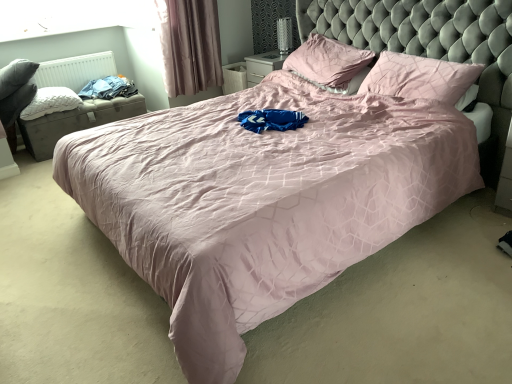
What do you see at coordinates (75, 70) in the screenshot? This screenshot has width=512, height=384. I see `white matte radiator at upper left` at bounding box center [75, 70].

This screenshot has width=512, height=384. Describe the element at coordinates (71, 16) in the screenshot. I see `transparent glass window screen at upper left` at that location.

What do you see at coordinates (420, 78) in the screenshot?
I see `pink fabric pillow at upper right, acting as the first pillow starting from the right` at bounding box center [420, 78].

The width and height of the screenshot is (512, 384). Describe the element at coordinates (189, 45) in the screenshot. I see `mauve velvet curtain at upper left` at that location.

Describe the element at coordinates (51, 102) in the screenshot. I see `white quilted pillow at left, arranged as the 1th pillow when viewed from the left` at that location.

The image size is (512, 384). Describe the element at coordinates (330, 64) in the screenshot. I see `pink satin pillow at upper center, which is the second pillow from right to left` at that location.

Identify the location of pink satin pillow at upper center, which is the second pillow from right to left. (330, 64).

Locate an element on the screen. Image resolution: width=512 pixels, height=384 pixels. blue cotton clothes at left is located at coordinates (108, 88).

Identify the location of white matte radiator at upper left. (75, 70).

Can you confirm if pink fabric pillow at upper right, which is the third pillow in left-to-right order, is thinner than blue cotton clothes at left?

Indeed, pink fabric pillow at upper right, which is the third pillow in left-to-right order, has a lesser width compared to blue cotton clothes at left.

Does pink fabric pillow at upper right, which is the third pillow in left-to-right order, have a smaller size compared to blue cotton clothes at left?

Actually, pink fabric pillow at upper right, which is the third pillow in left-to-right order, might be larger than blue cotton clothes at left.

Relative to blue cotton clothes at left, is pink fabric pillow at upper right, acting as the first pillow starting from the right, in front or behind?

Clearly, pink fabric pillow at upper right, acting as the first pillow starting from the right, is in front of blue cotton clothes at left.

Is pink fabric pillow at upper right, which is the third pillow in left-to-right order, not inside blue cotton clothes at left?

That's correct, pink fabric pillow at upper right, which is the third pillow in left-to-right order, is outside of blue cotton clothes at left.

Considering the positions of point (77, 0) and point (41, 105), is point (77, 0) closer or farther from the camera than point (41, 105)?

Clearly, point (77, 0) is more distant from the camera than point (41, 105).

Is transparent glass window screen at upper left bigger than white quilted pillow at left, marked as the 3th pillow in a right-to-left arrangement?

Incorrect, transparent glass window screen at upper left is not larger than white quilted pillow at left, marked as the 3th pillow in a right-to-left arrangement.

Which of these two, transparent glass window screen at upper left or white quilted pillow at left, marked as the 3th pillow in a right-to-left arrangement, is wider?

Wider between the two is white quilted pillow at left, marked as the 3th pillow in a right-to-left arrangement.

Is transparent glass window screen at upper left oriented away from white quilted pillow at left, arranged as the 1th pillow when viewed from the left?

No, transparent glass window screen at upper left is not facing the opposite direction of white quilted pillow at left, arranged as the 1th pillow when viewed from the left.

Is metallic silver table lamp at upper center far away from transparent glass window screen at upper left?

Yes.

Can you confirm if metallic silver table lamp at upper center is wider than transparent glass window screen at upper left?

Yes, metallic silver table lamp at upper center is wider than transparent glass window screen at upper left.

Based on the photo, between metallic silver table lamp at upper center and transparent glass window screen at upper left, which one is positioned in front?

transparent glass window screen at upper left.

Is metallic silver table lamp at upper center oriented towards transparent glass window screen at upper left?

No, metallic silver table lamp at upper center is not oriented towards transparent glass window screen at upper left.

Consider the image. Is blue cotton clothes at left completely or partially outside of mauve velvet curtain at upper left?

Yes.

Who is taller, blue cotton clothes at left or mauve velvet curtain at upper left?

With more height is mauve velvet curtain at upper left.

From a real-world perspective, is blue cotton clothes at left located beneath mauve velvet curtain at upper left?

Yes, from a real-world perspective, blue cotton clothes at left is under mauve velvet curtain at upper left.

Which is farther, (81, 96) or (213, 4)?

The point (213, 4) is more distant.

Considering the positions of points (55, 109) and (284, 30), is point (55, 109) closer to camera compared to point (284, 30)?

Yes, point (55, 109) is in front of point (284, 30).

The width and height of the screenshot is (512, 384). In order to click on table lamp above the white quilted pillow at left, arranged as the 1th pillow when viewed from the left (from the image's perspective) in this screenshot , I will do `click(284, 35)`.

Is white quilted pillow at left, arranged as the 1th pillow when viewed from the left, wider or thinner than metallic silver table lamp at upper center?

Clearly, white quilted pillow at left, arranged as the 1th pillow when viewed from the left, has more width compared to metallic silver table lamp at upper center.

Can you confirm if white matte radiator at upper left is smaller than white quilted pillow at left, arranged as the 1th pillow when viewed from the left?

Yes, white matte radiator at upper left is smaller than white quilted pillow at left, arranged as the 1th pillow when viewed from the left.

How many degrees apart are the facing directions of white matte radiator at upper left and white quilted pillow at left, arranged as the 1th pillow when viewed from the left?

The angular difference between white matte radiator at upper left and white quilted pillow at left, arranged as the 1th pillow when viewed from the left, is 0.00139 degrees.

Is white matte radiator at upper left wider or thinner than white quilted pillow at left, marked as the 3th pillow in a right-to-left arrangement?

white matte radiator at upper left is thinner than white quilted pillow at left, marked as the 3th pillow in a right-to-left arrangement.

Between point (97, 73) and point (58, 98), which one is positioned in front?

The point (58, 98) is in front.

From the image's perspective, would you say pink satin pillow at upper center, which is the 2th pillow in left-to-right order, is positioned over white matte radiator at upper left?

No, from the image's perspective, pink satin pillow at upper center, which is the 2th pillow in left-to-right order, is not above white matte radiator at upper left.

This screenshot has width=512, height=384. I want to click on the 1st pillow below when counting from the white matte radiator at upper left (from the image's perspective), so click(x=330, y=64).

Can you confirm if pink satin pillow at upper center, which is the second pillow from right to left, is smaller than white matte radiator at upper left?

No.

Is pink satin pillow at upper center, which is the 2th pillow in left-to-right order, facing towards white matte radiator at upper left?

No, pink satin pillow at upper center, which is the 2th pillow in left-to-right order, is not aimed at white matte radiator at upper left.

At what (x,y) coordinates should I click in order to perform the action: click on the 2nd pillow counting from the right side of the blue cotton clothes at left. Please return your answer as a coordinate pair (x, y). Image resolution: width=512 pixels, height=384 pixels. Looking at the image, I should click on (420, 78).

From a real-world perspective, starting from the transparent glass window screen at upper left, which pillow is the 3rd one below it? Please provide its 2D coordinates.

[(51, 102)]

Based on their spatial positions, is pink satin pillow at upper center, which is the second pillow from right to left, or pink fabric pillow at upper right, which is the third pillow in left-to-right order, further from metallic silver table lamp at upper center?

pink fabric pillow at upper right, which is the third pillow in left-to-right order, lies further to metallic silver table lamp at upper center than the other object.

Based on their spatial positions, is blue cotton clothes at left or metallic silver table lamp at upper center further from mauve velvet curtain at upper left?

Based on the image, metallic silver table lamp at upper center appears to be further to mauve velvet curtain at upper left.

Based on the photo, which object lies further to the anchor point mauve velvet curtain at upper left, pink satin pillow at upper center, which is the 2th pillow in left-to-right order, or blue cotton clothes at left?

Among the two, pink satin pillow at upper center, which is the 2th pillow in left-to-right order, is located further to mauve velvet curtain at upper left.

Considering their positions, is mauve velvet curtain at upper left positioned closer to blue cotton clothes at left than white matte radiator at upper left?

The object closer to blue cotton clothes at left is white matte radiator at upper left.

Estimate the real-world distances between objects in this image. Which object is closer to pink fabric pillow at upper right, which is the third pillow in left-to-right order, blue cotton clothes at left or white matte radiator at upper left?

blue cotton clothes at left is closer to pink fabric pillow at upper right, which is the third pillow in left-to-right order.

Estimate the real-world distances between objects in this image. Which object is closer to pink satin pillow at upper center, which is the second pillow from right to left, blue cotton clothes at left or white matte radiator at upper left?

blue cotton clothes at left is closer to pink satin pillow at upper center, which is the second pillow from right to left.

Estimate the real-world distances between objects in this image. Which object is closer to transparent glass window screen at upper left, blue cotton clothes at left or mauve velvet curtain at upper left?

blue cotton clothes at left lies closer to transparent glass window screen at upper left than the other object.

Which object lies further to the anchor point pink satin pillow at upper center, which is the 2th pillow in left-to-right order, white matte radiator at upper left or mauve velvet curtain at upper left?

white matte radiator at upper left lies further to pink satin pillow at upper center, which is the 2th pillow in left-to-right order, than the other object.

Image resolution: width=512 pixels, height=384 pixels. Find the location of `window screen between white quilted pillow at left, arranged as the 1th pillow when viewed from the left, and pink fabric pillow at upper right, which is the third pillow in left-to-right order, from left to right`. window screen between white quilted pillow at left, arranged as the 1th pillow when viewed from the left, and pink fabric pillow at upper right, which is the third pillow in left-to-right order, from left to right is located at coordinates (x=71, y=16).

Locate an element on the screen. This screenshot has width=512, height=384. table lamp between white quilted pillow at left, marked as the 3th pillow in a right-to-left arrangement, and pink fabric pillow at upper right, acting as the first pillow starting from the right, from left to right is located at coordinates (284, 35).

You are a GUI agent. You are given a task and a screenshot of the screen. Output one action in this format:
    pyautogui.click(x=<x>, y=<y>)
    Task: Click on the clothing between white quilted pillow at left, arranged as the 1th pillow when viewed from the left, and mauve velvet curtain at upper left from left to right
    
    Given the screenshot: What is the action you would take?
    pyautogui.click(x=108, y=88)

Locate an element on the screen. This screenshot has width=512, height=384. pillow between white matte radiator at upper left and pink fabric pillow at upper right, which is the third pillow in left-to-right order is located at coordinates (330, 64).